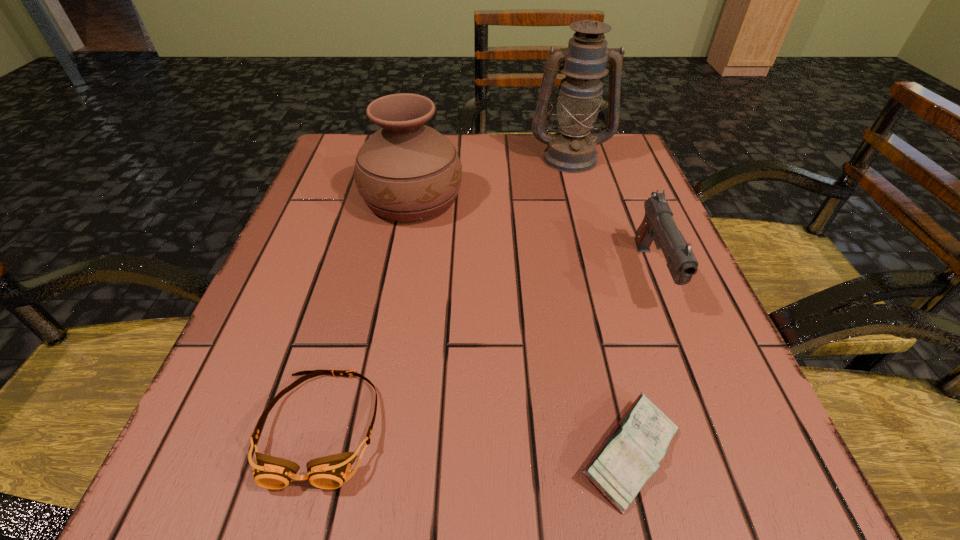
Locate an element on the screen. oil lamp situated at the far edge is located at coordinates (572, 150).

Locate an element on the screen. This screenshot has width=960, height=540. urn located in the far edge section of the desktop is located at coordinates (407, 171).

Where is `goggles that is at the near edge`? goggles that is at the near edge is located at coordinates (330, 472).

You are a GUI agent. You are given a task and a screenshot of the screen. Output one action in this format:
    pyautogui.click(x=<x>, y=<y>)
    Task: Click on the diary located at the near edge
    The image size is (960, 540).
    Given the screenshot: What is the action you would take?
    pyautogui.click(x=630, y=455)

At what (x,y) coordinates should I click in order to perform the action: click on urn that is at the left edge. Please return your answer as a coordinate pair (x, y). The width and height of the screenshot is (960, 540). Looking at the image, I should click on (407, 171).

Locate an element on the screen. goggles that is at the left edge is located at coordinates [x=330, y=472].

In order to click on oil lamp at the right edge in this screenshot , I will do `click(572, 150)`.

Image resolution: width=960 pixels, height=540 pixels. I want to click on gun located at the right edge, so click(x=658, y=224).

The width and height of the screenshot is (960, 540). I want to click on diary at the right edge, so click(630, 455).

Find the location of a particular element. The width and height of the screenshot is (960, 540). object situated at the far left corner is located at coordinates (407, 171).